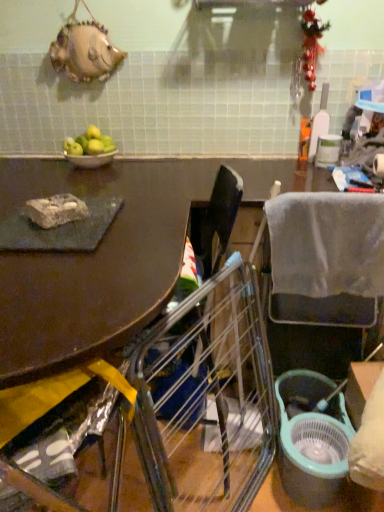
You are a GUI agent. You are given a task and a screenshot of the screen. Output one action in this format:
    pyautogui.click(x=<x>, y=<y>)
    Task: Click on the spots to the right of rocky stone at left
    The width and height of the screenshot is (384, 512).
    Given the screenshot: What is the action you would take?
    point(135,221)